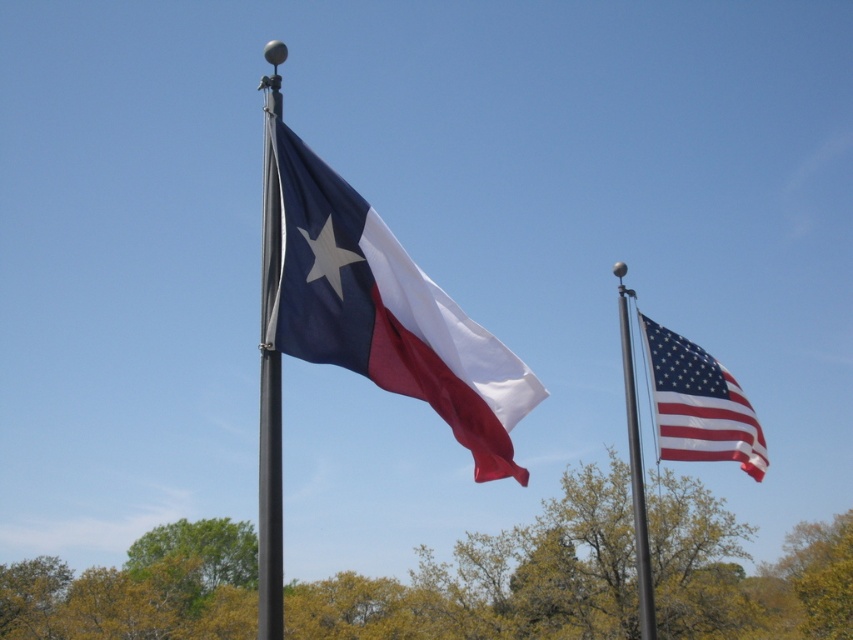
Who is taller, matte polyester flag at center or american flag at right?

matte polyester flag at center

Which is more to the right, matte polyester flag at center or american flag at right?

Positioned to the right is american flag at right.

Does point (486, 444) come farther from viewer compared to point (703, 445)?

No, it is in front of (703, 445).

Identify the location of matte polyester flag at center. This screenshot has height=640, width=853. (386, 312).

Does american flag at right have a lesser height compared to metallic pole at right?

Indeed, american flag at right has a lesser height compared to metallic pole at right.

Measure the distance between american flag at right and camera.

50.08 feet

Describe the element at coordinates (698, 404) in the screenshot. I see `american flag at right` at that location.

In order to click on american flag at right in this screenshot , I will do `click(698, 404)`.

Can you confirm if matte polyester flag at center is taller than metallic pole at right?

Incorrect, matte polyester flag at center's height is not larger of metallic pole at right's.

Between matte polyester flag at center and metallic pole at right, which one has more height?

metallic pole at right is taller.

Does point (323, 320) come closer to viewer compared to point (624, 378)?

Yes, it is.

The image size is (853, 640). In order to click on matte polyester flag at center in this screenshot , I will do coord(386,312).